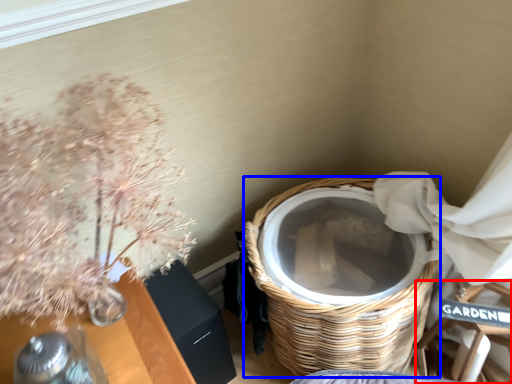
Question: Which point is further to the camera, armchair (highlighted by a red box) or basket (highlighted by a blue box)?

Choices:
 (A) armchair
 (B) basket

Answer: (A)